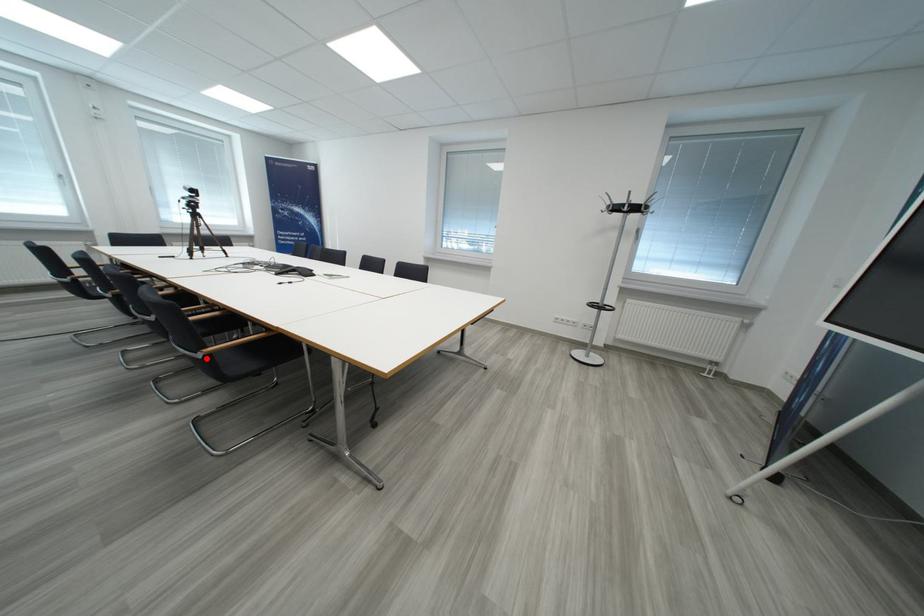
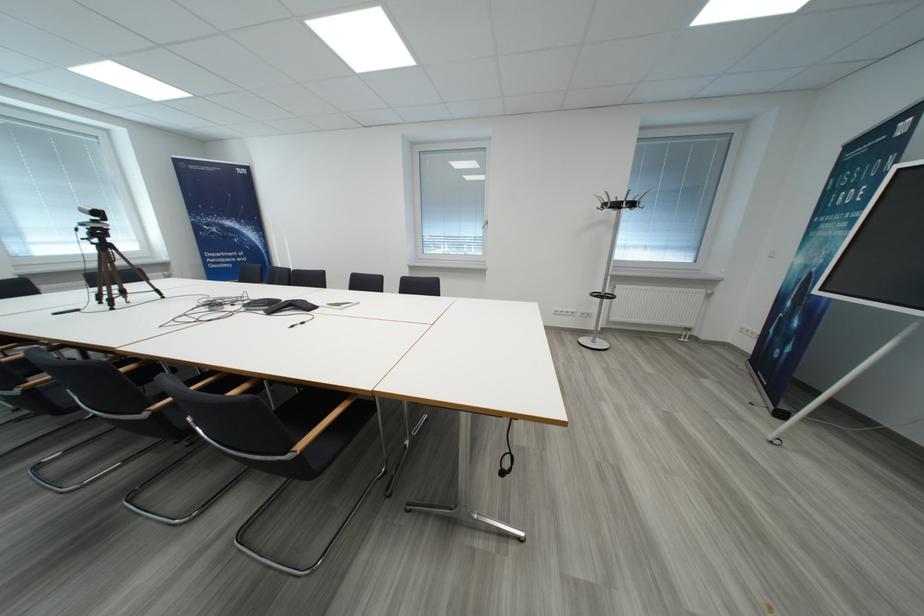
Where in the second image is the point corresponding to the highlighted location from the first image?

(296, 460)